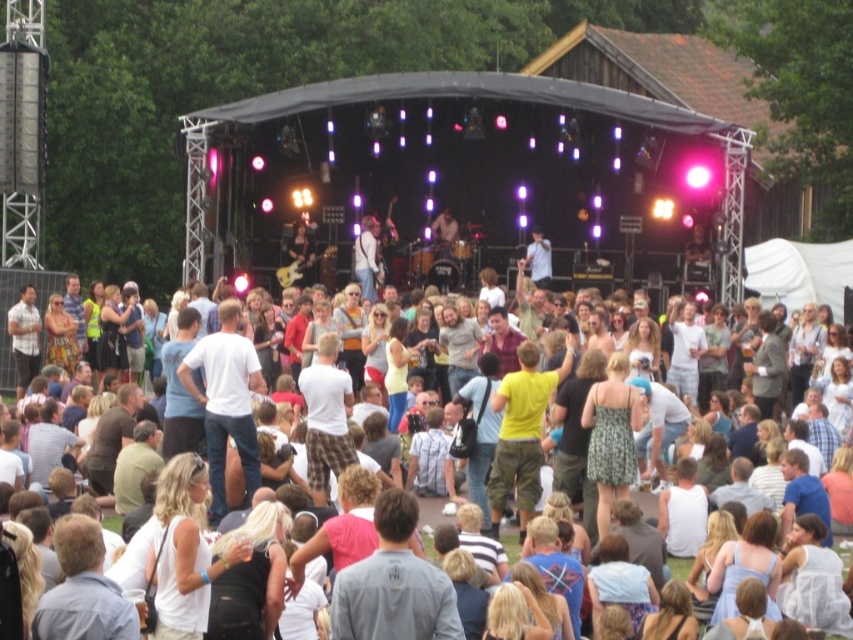
You are a photographer at the concert and want to capture both the light blue cotton shirt at center and the light brown leather jacket at center in a single photo. Which clothing item will appear bigger in the photo?

The light blue cotton shirt at center will appear bigger in the photo because it is larger in size than the light brown leather jacket at center.

You are a photographer standing at the edge of the crowd. You want to take a photo that includes both the white cotton shirt at center and the light brown leather guitar at center. Given that your camera has a maximum focus range of 45 meters, will you be able to capture both subjects clearly in the same shot?

The white cotton shirt at center is 46.23 meters from the light brown leather guitar at center. Since the distance between them exceeds the camera maximum focus range of 45 meters, you won not be able to capture both subjects clearly in the same shot.